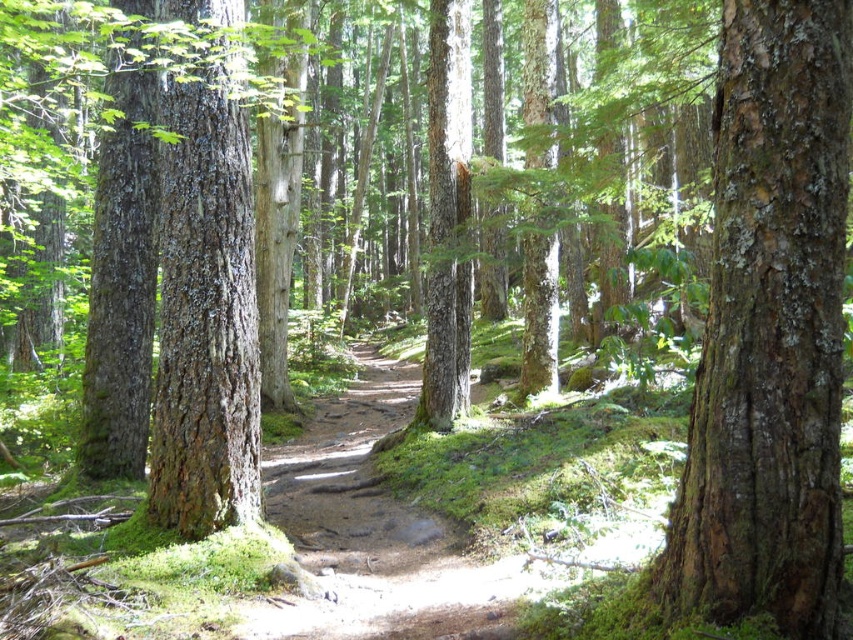
Question: Among these objects, which one is farthest from the camera?

Choices:
 (A) smooth brown bark at center
 (B) smooth brown bark tree at center

Answer: (B)

Question: Can you confirm if smooth brown bark at center is bigger than smooth brown bark tree at center?

Choices:
 (A) no
 (B) yes

Answer: (A)

Question: Which of the following is the farthest from the observer?

Choices:
 (A) (171, 323)
 (B) (819, 500)

Answer: (A)

Question: Is smooth brown bark at center wider than smooth brown bark tree at center?

Choices:
 (A) no
 (B) yes

Answer: (A)

Question: Does smooth brown bark at center lie behind smooth brown bark tree at center?

Choices:
 (A) no
 (B) yes

Answer: (A)

Question: Among these points, which one is nearest to the camera?

Choices:
 (A) (178, 387)
 (B) (784, 104)

Answer: (B)